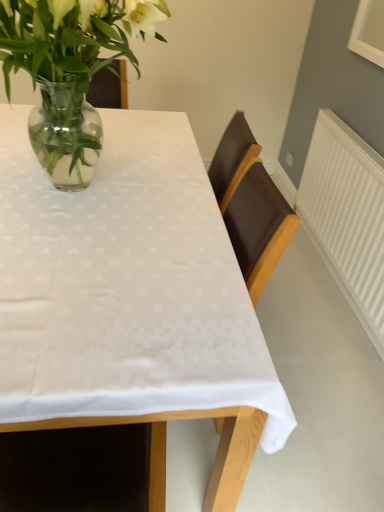
Where is `vacant point above white fabric table at center (from a real-world perspective)`? vacant point above white fabric table at center (from a real-world perspective) is located at coordinates (128, 193).